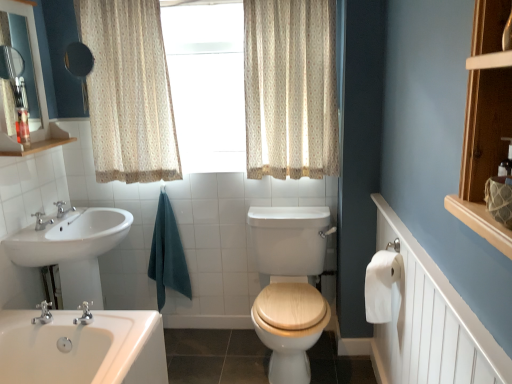
Question: Is matte black mirror at upper left positioned beyond the bounds of white glossy sink at lower left?

Choices:
 (A) yes
 (B) no

Answer: (A)

Question: Considering the relative sizes of matte black mirror at upper left and white glossy sink at lower left in the image provided, is matte black mirror at upper left taller than white glossy sink at lower left?

Choices:
 (A) no
 (B) yes

Answer: (A)

Question: From a real-world perspective, is matte black mirror at upper left below white glossy sink at lower left?

Choices:
 (A) yes
 (B) no

Answer: (B)

Question: From a real-world perspective, is matte black mirror at upper left positioned over white glossy sink at lower left based on gravity?

Choices:
 (A) no
 (B) yes

Answer: (B)

Question: Is white glossy sink at lower left at the back of matte black mirror at upper left?

Choices:
 (A) no
 (B) yes

Answer: (A)

Question: Is matte black mirror at upper left not close to white glossy sink at lower left?

Choices:
 (A) no
 (B) yes

Answer: (A)

Question: Considering the relative sizes of white paper at right and beige floral fabric curtain at upper center, the second curtain when ordered from left to right, in the image provided, is white paper at right smaller than beige floral fabric curtain at upper center, the second curtain when ordered from left to right,?

Choices:
 (A) yes
 (B) no

Answer: (A)

Question: Can you confirm if white paper at right is wider than beige floral fabric curtain at upper center, which is the first curtain from right to left?

Choices:
 (A) no
 (B) yes

Answer: (A)

Question: From a real-world perspective, is white paper at right below beige floral fabric curtain at upper center, the second curtain when ordered from left to right?

Choices:
 (A) no
 (B) yes

Answer: (B)

Question: Is white paper at right taller than beige floral fabric curtain at upper center, which is the first curtain from right to left?

Choices:
 (A) no
 (B) yes

Answer: (A)

Question: Does white paper at right turn towards beige floral fabric curtain at upper center, which is the first curtain from right to left?

Choices:
 (A) yes
 (B) no

Answer: (B)

Question: From a real-world perspective, is white paper at right located higher than beige floral fabric curtain at upper center, the second curtain when ordered from left to right?

Choices:
 (A) yes
 (B) no

Answer: (B)

Question: From a real-world perspective, is white glossy sink at lower left beneath white textured radiator at right?

Choices:
 (A) no
 (B) yes

Answer: (A)